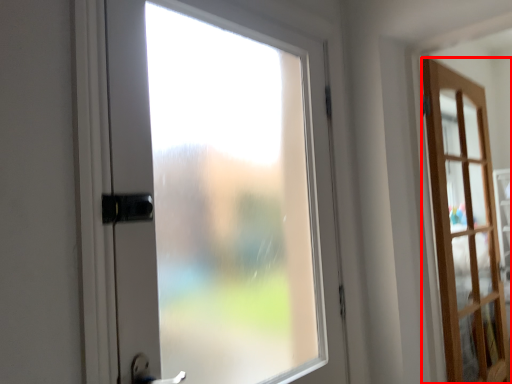
Question: From the image's perspective, where is door (annotated by the red box) located relative to door?

Choices:
 (A) above
 (B) below

Answer: (B)